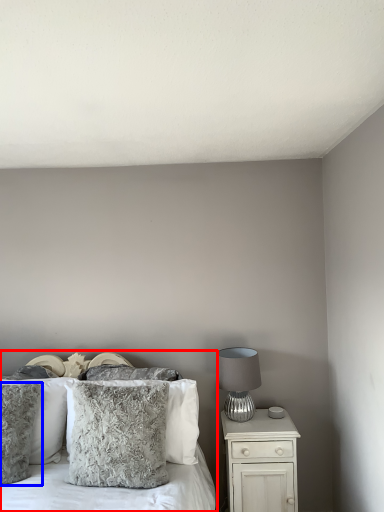
Question: Which of the following is the closest to the observer, bed (highlighted by a red box) or pillow (highlighted by a blue box)?

Choices:
 (A) bed
 (B) pillow

Answer: (A)